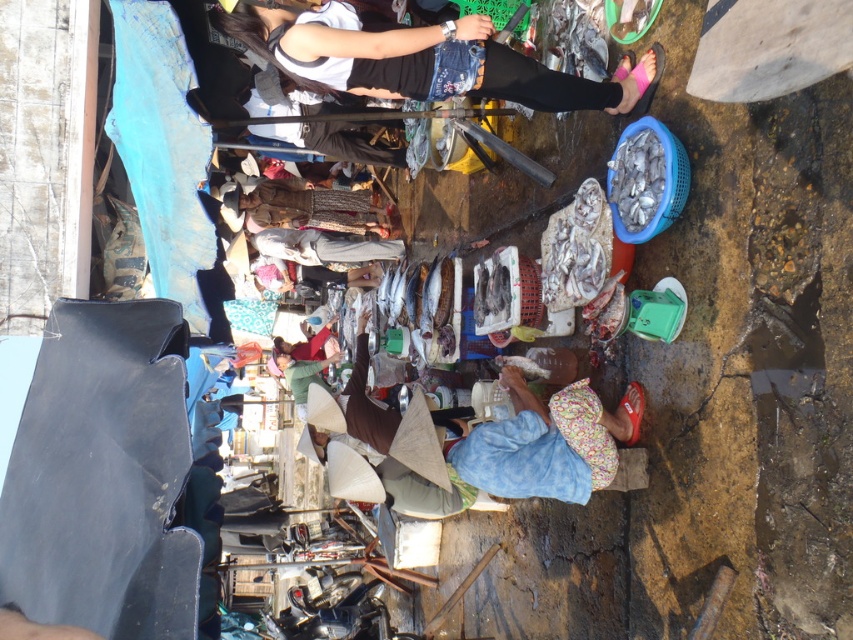
Is denim pants at upper center taller than dark brown woven hat at center?

Indeed, denim pants at upper center has a greater height compared to dark brown woven hat at center.

Find the location of `denim pants at upper center`. denim pants at upper center is located at coordinates (422, 60).

Does light gray fabric pants at center come behind dark brown woven hat at center?

No, light gray fabric pants at center is closer to the viewer.

How distant is light gray fabric pants at center from dark brown woven hat at center?

light gray fabric pants at center is 1.10 meters away from dark brown woven hat at center.

Between point (351, 250) and point (262, 273), which one is positioned in front?

Point (351, 250)

I want to click on light gray fabric pants at center, so click(x=322, y=246).

Is dark brown woven hat at center smaller than red fabric shirt at center?

Correct, dark brown woven hat at center occupies less space than red fabric shirt at center.

Does point (318, 284) lie in front of point (326, 332)?

Yes, point (318, 284) is closer to viewer.

Locate an element on the screen. dark brown woven hat at center is located at coordinates (312, 275).

I want to click on dark brown woven hat at center, so click(x=312, y=275).